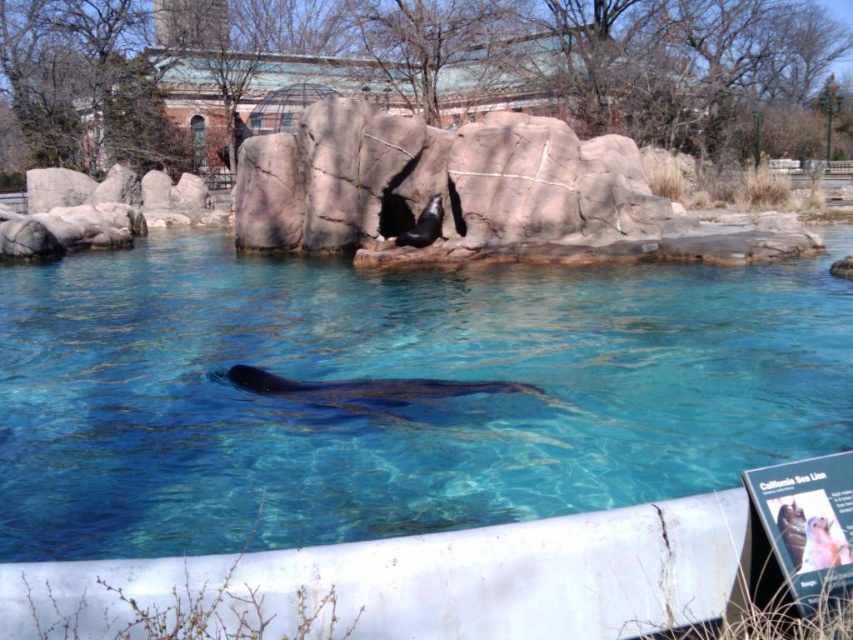
You are a zookeeper observing the sea lion enclosure. You notice the clear blue water at center and the black smooth whale at center. Which object is located above the other?

The clear blue water at center is positioned over the black smooth whale at center.

You are a zookeeper planning to feed the sea lions. You need to walk from the entrance to the feeding station located behind the rough stone rock at center. Can you walk directly through the clear blue water at center to reach it?

The clear blue water at center is in front of the rough stone rock at center, so you can walk directly through the clear blue water at center to reach the feeding station behind the rough stone rock at center.